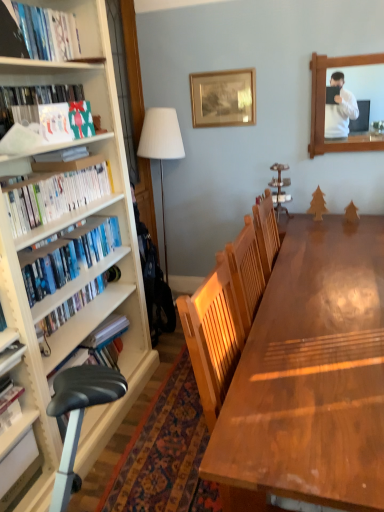
Where is `blank space above shiny brown wooden table at center (from a real-world perspective)`? Image resolution: width=384 pixels, height=512 pixels. blank space above shiny brown wooden table at center (from a real-world perspective) is located at coordinates (329, 317).